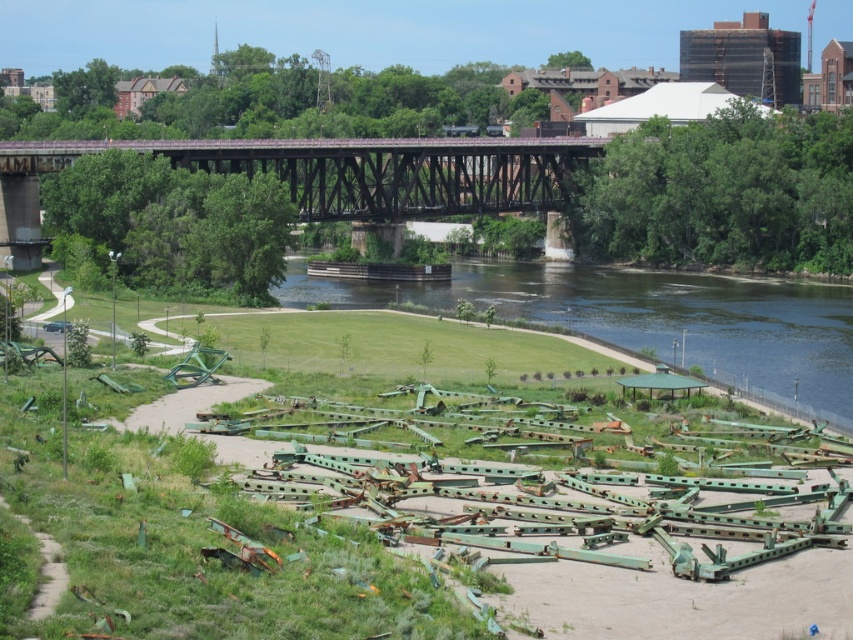
Is green grass at lower center below rusty metal bridge at upper center?

Yes.

Does green grass at lower center appear on the right side of rusty metal bridge at upper center?

Indeed, green grass at lower center is positioned on the right side of rusty metal bridge at upper center.

Is point (614, 280) farther from viewer compared to point (422, 186)?

No, (614, 280) is in front of (422, 186).

What are the coordinates of `green grass at lower center` in the screenshot? It's located at (650, 320).